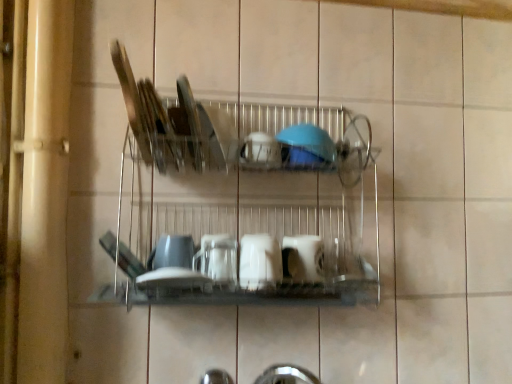
Question: Considering the relative positions of blue glossy bowl at center, which ranks as the fourth tableware in bottom-to-top order, and clear glass plate at center, the 6th tableware from the bottom, in the image provided, is blue glossy bowl at center, which ranks as the fourth tableware in bottom-to-top order, to the right of clear glass plate at center, the 6th tableware from the bottom, from the viewer's perspective?

Choices:
 (A) yes
 (B) no

Answer: (A)

Question: Is blue glossy bowl at center, which ranks as the fourth tableware in bottom-to-top order, positioned far away from clear glass plate at center, the 1th tableware when ordered from top to bottom?

Choices:
 (A) yes
 (B) no

Answer: (B)

Question: Can you confirm if blue glossy bowl at center, the 3th tableware from the top, is bigger than clear glass plate at center, the 1th tableware when ordered from top to bottom?

Choices:
 (A) no
 (B) yes

Answer: (A)

Question: Is blue glossy bowl at center, the 3th tableware from the top, outside clear glass plate at center, the 1th tableware when ordered from top to bottom?

Choices:
 (A) yes
 (B) no

Answer: (A)

Question: Is blue glossy bowl at center, which ranks as the fourth tableware in bottom-to-top order, smaller than clear glass plate at center, the 6th tableware from the bottom?

Choices:
 (A) no
 (B) yes

Answer: (B)

Question: From the image's perspective, would you say blue glossy bowl at center, the 3th tableware from the top, is shown under clear glass plate at center, the 1th tableware when ordered from top to bottom?

Choices:
 (A) yes
 (B) no

Answer: (A)

Question: Is blue glossy bowl at center, which ranks as the fourth tableware in bottom-to-top order, closer to the viewer compared to white glossy cup at center, the third tableware in the bottom-to-top sequence?

Choices:
 (A) no
 (B) yes

Answer: (A)

Question: Considering the relative sizes of blue glossy bowl at center, which ranks as the fourth tableware in bottom-to-top order, and white glossy cup at center, which is the 4th tableware in top-to-bottom order, in the image provided, is blue glossy bowl at center, which ranks as the fourth tableware in bottom-to-top order, taller than white glossy cup at center, which is the 4th tableware in top-to-bottom order,?

Choices:
 (A) yes
 (B) no

Answer: (B)

Question: From a real-world perspective, is blue glossy bowl at center, the 3th tableware from the top, on top of white glossy cup at center, the third tableware in the bottom-to-top sequence?

Choices:
 (A) no
 (B) yes

Answer: (B)

Question: Is there a large distance between blue glossy bowl at center, the 3th tableware from the top, and white glossy cup at center, which is the 4th tableware in top-to-bottom order?

Choices:
 (A) yes
 (B) no

Answer: (B)

Question: Can you confirm if blue glossy bowl at center, which ranks as the fourth tableware in bottom-to-top order, is bigger than white glossy cup at center, the third tableware in the bottom-to-top sequence?

Choices:
 (A) yes
 (B) no

Answer: (B)

Question: Does blue glossy bowl at center, the 3th tableware from the top, appear on the right side of white glossy cup at center, which is the 4th tableware in top-to-bottom order?

Choices:
 (A) yes
 (B) no

Answer: (B)

Question: Does white glossy cup at center, which is the 1th tableware from bottom to top, appear on the left side of clear glass plate at center, the 6th tableware from the bottom?

Choices:
 (A) yes
 (B) no

Answer: (B)